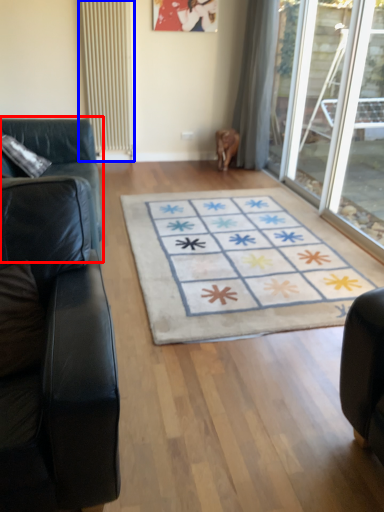
Question: Which object is closer to the camera taking this photo, studio couch (highlighted by a red box) or radiator (highlighted by a blue box)?

Choices:
 (A) studio couch
 (B) radiator

Answer: (A)